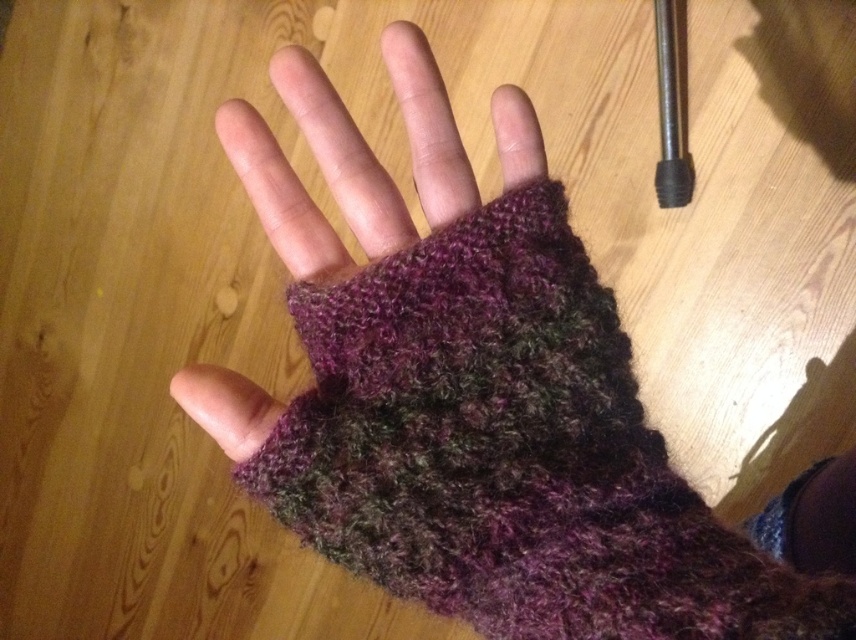
You are an interior designer arranging items on a display table. You have two gloves to place on the table. The multicolor knitted fingerless glove at center and the fuzzy woolen fingerless glove at center. According to the image, which glove should you place lower on the table to maintain the arrangement shown?

The multicolor knitted fingerless glove at center should be placed lower on the table since it is positioned below the fuzzy woolen fingerless glove at center in the image.

You are standing in a room with a wooden floor and a black cylindrical object in the corner. You see a multicolor knitted fingerless glove at center. Where is the glove positioned relative to the black cylindrical object?

The multicolor knitted fingerless glove at center is located at point (510, 451), which places it to the lower left of the black cylindrical object in the upper right corner.

You are a photographer trying to capture the glove in the image. You need to adjust your camera to focus on the point at position point (455,204) and point (807,545). Which point should you focus on first to ensure the foreground is sharp?

Point (455,204) is in front of point (807,545), so you should focus on point (455,204) first to ensure the foreground is sharp.